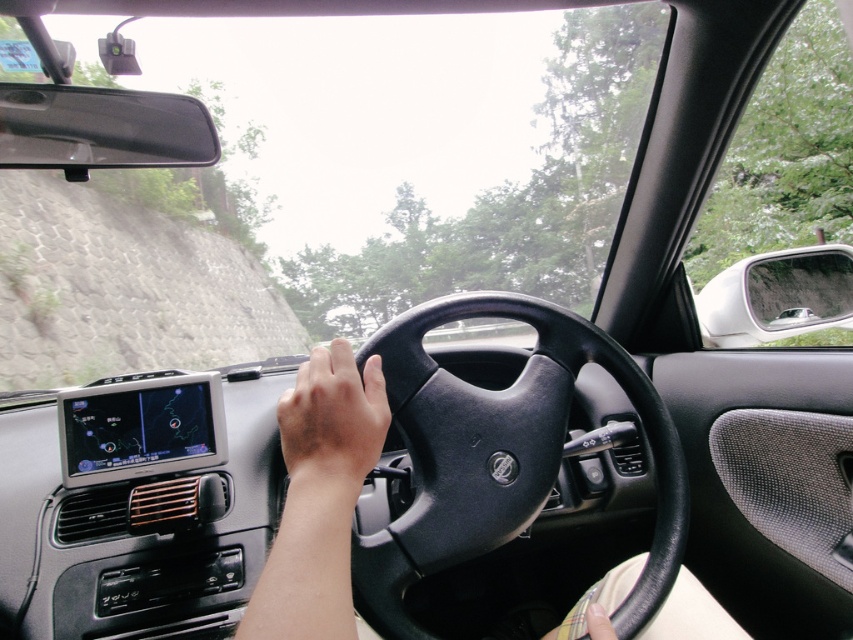
Question: Is black matte steering wheel at center in front of gray stone wall at upper left?

Choices:
 (A) no
 (B) yes

Answer: (B)

Question: Does gray stone wall at upper left have a lesser width compared to brown matte hand at center?

Choices:
 (A) yes
 (B) no

Answer: (B)

Question: Which of the following is the closest to the observer?

Choices:
 (A) (544, 432)
 (B) (4, 189)

Answer: (A)

Question: Which point is farther to the camera?

Choices:
 (A) brown matte hand at center
 (B) gray stone wall at upper left
 (C) black matte steering wheel at center

Answer: (B)

Question: Which point is closer to the camera taking this photo?

Choices:
 (A) (339, 388)
 (B) (74, 260)
 (C) (425, 326)

Answer: (A)

Question: Does gray stone wall at upper left have a smaller size compared to brown matte hand at center?

Choices:
 (A) no
 (B) yes

Answer: (A)